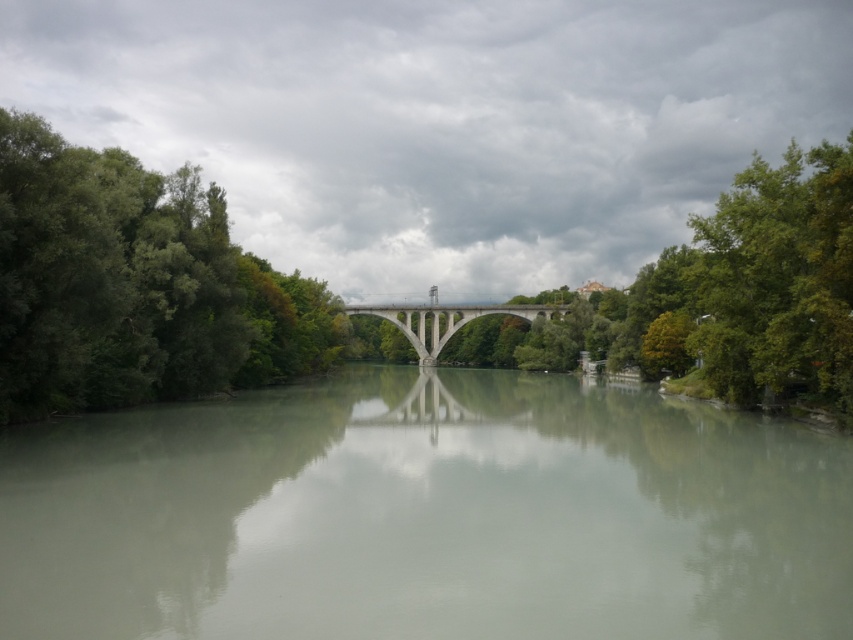
Based on the scene description, which object occupies more space in the image between the green leafy tree at center and the concrete bridge at center?

The green leafy tree at center has a larger size compared to the concrete bridge at center, so it occupies more space in the image.

You are standing at the point with coordinates (426,515) in the river scene. Based on the image description, what type of surface are you currently standing on?

The point (426,515) is on clear water at center, so you are standing on clear water.

You are standing at the center of the stone bridge in the river scene. You notice two points marked in the image. Which point, point (368,470) or point (350,349), is closer to your current position?

Point (368,470) is closer to the camera than point (350,349), so if you are at the center of the stone bridge, point (368,470) would be closer to your current position.